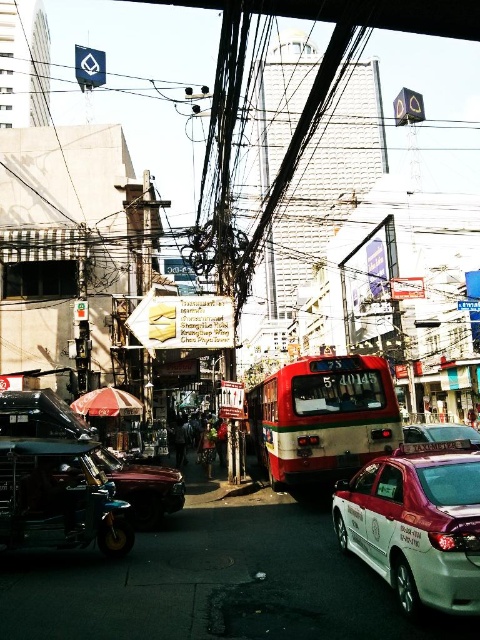
Question: Can you confirm if white metallic taxi at center is smaller than red matte bus at center?

Choices:
 (A) yes
 (B) no

Answer: (A)

Question: Is white metallic taxi at center closer to camera compared to metallic red scooter at lower left?

Choices:
 (A) no
 (B) yes

Answer: (B)

Question: Which point appears farthest from the camera in this image?

Choices:
 (A) (411, 497)
 (B) (120, 460)
 (C) (67, 449)

Answer: (B)

Question: Can you confirm if white metallic taxi at center is positioned to the left of red matte bus at center?

Choices:
 (A) yes
 (B) no

Answer: (B)

Question: Which object appears closest to the camera in this image?

Choices:
 (A) white metallic taxi at center
 (B) dark blue fabric at center

Answer: (A)

Question: Which object is positioned farthest from the metallic red scooter at lower left?

Choices:
 (A) dark blue fabric at center
 (B) metallic silver scooter at lower left
 (C) red matte bus at center
 (D) metallic silver taxi at center

Answer: (A)